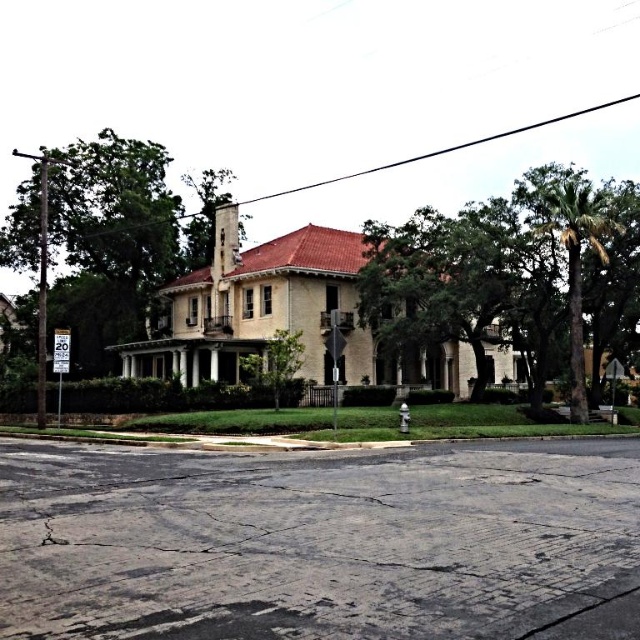
How far apart are green leafy tree at center and white plastic speed limit sign at left?

green leafy tree at center and white plastic speed limit sign at left are 10.06 meters apart.

Does green leafy tree at center have a greater height compared to white plastic speed limit sign at left?

In fact, green leafy tree at center may be shorter than white plastic speed limit sign at left.

Between point (301, 348) and point (64, 339), which one is positioned in front?

Point (64, 339) is in front.

This screenshot has width=640, height=640. Find the location of `green leafy tree at center`. green leafy tree at center is located at coordinates (275, 362).

Based on the photo, is black asphalt at lower center taller than green leafy tree at right?

No.

Is point (627, 573) less distant than point (563, 198)?

Yes, point (627, 573) is closer to viewer.

Locate an element on the screen. black asphalt at lower center is located at coordinates (317, 545).

Which is in front, point (612, 474) or point (4, 241)?

Point (612, 474) is in front.

Is black asphalt at lower center in front of green leafy tree at left?

Yes, it is.

Where is `black asphalt at lower center`? The height and width of the screenshot is (640, 640). black asphalt at lower center is located at coordinates (317, 545).

Identify the location of black asphalt at lower center. This screenshot has width=640, height=640. click(x=317, y=545).